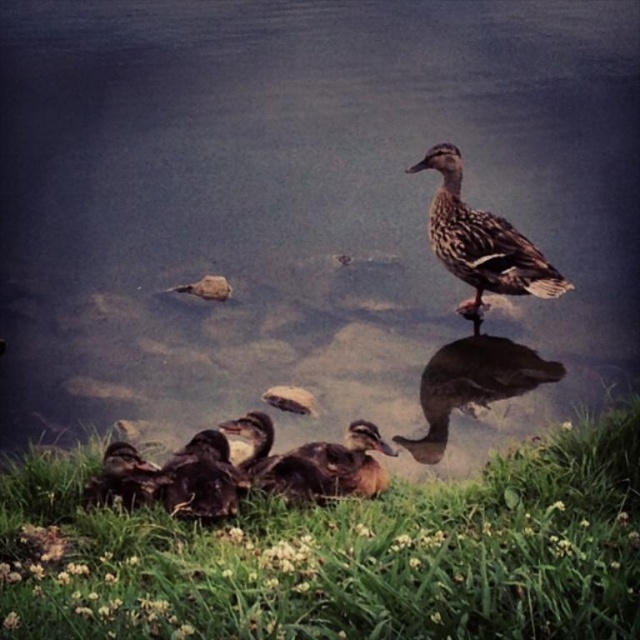
Between point (173, 468) and point (112, 472), which one is positioned in front?

Point (112, 472)

Can you confirm if brown fuzzy ducklings at lower center is smaller than brown fuzzy duckling at lower left?

No, brown fuzzy ducklings at lower center is not smaller than brown fuzzy duckling at lower left.

Who is more distant from viewer, (218,515) or (120,476)?

The point (120,476) is behind.

This screenshot has width=640, height=640. In order to click on brown fuzzy ducklings at lower center in this screenshot , I will do `click(202, 477)`.

Who is more distant from viewer, (278, 472) or (189, 438)?

The point (189, 438) is more distant.

Between point (339, 493) and point (236, 500), which one is positioned in front?

Point (236, 500)

The image size is (640, 640). I want to click on brown fuzzy duckling at center, so click(x=330, y=467).

Is brown feathered duck at center to the left of brown fuzzy ducklings at lower center from the viewer's perspective?

Incorrect, brown feathered duck at center is not on the left side of brown fuzzy ducklings at lower center.

Is point (508, 340) positioned in front of point (221, 490)?

No, (508, 340) is behind (221, 490).

Where is `brown feathered duck at center`? This screenshot has height=640, width=640. brown feathered duck at center is located at coordinates (472, 385).